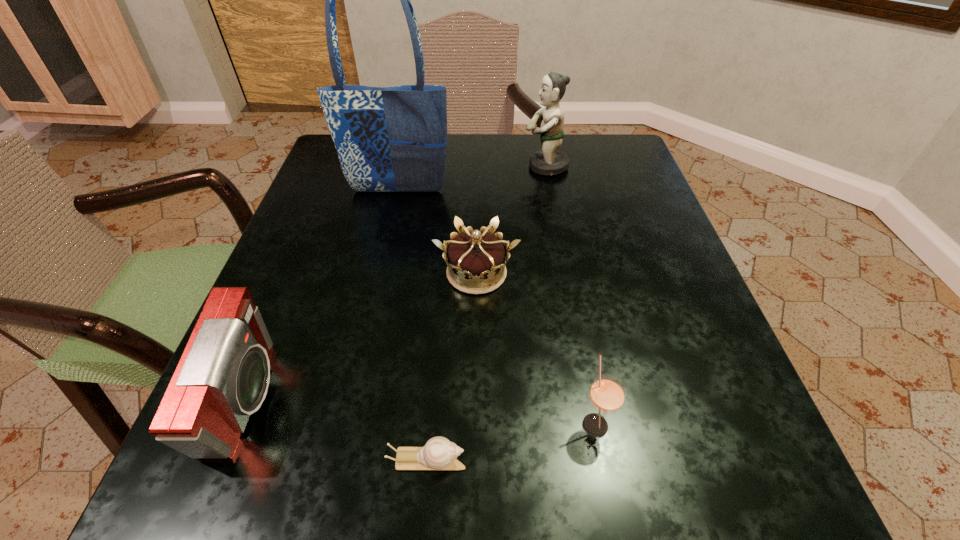
The image size is (960, 540). I want to click on escargot present at the near edge, so click(439, 453).

Find the location of `shopping bag positioned at the left edge`. shopping bag positioned at the left edge is located at coordinates (389, 139).

Find the location of a particular element. camera that is positioned at the left edge is located at coordinates (223, 375).

The image size is (960, 540). In order to click on object that is at the right edge in this screenshot , I will do `click(549, 161)`.

At what (x,y) coordinates should I click in order to perform the action: click on object that is at the far left corner. Please return your answer as a coordinate pair (x, y). Looking at the image, I should click on (389, 139).

At what (x,y) coordinates should I click in order to perform the action: click on object located in the near left corner section of the desktop. Please return your answer as a coordinate pair (x, y). The width and height of the screenshot is (960, 540). Looking at the image, I should click on 223,375.

In order to click on object situated at the far right corner in this screenshot , I will do pyautogui.click(x=549, y=161).

Image resolution: width=960 pixels, height=540 pixels. I want to click on vacant space at the far edge of the desktop, so click(x=456, y=147).

Locate an element on the screen. The width and height of the screenshot is (960, 540). vacant space at the near edge is located at coordinates (585, 470).

Where is `free space at the left edge of the desktop`? free space at the left edge of the desktop is located at coordinates (275, 307).